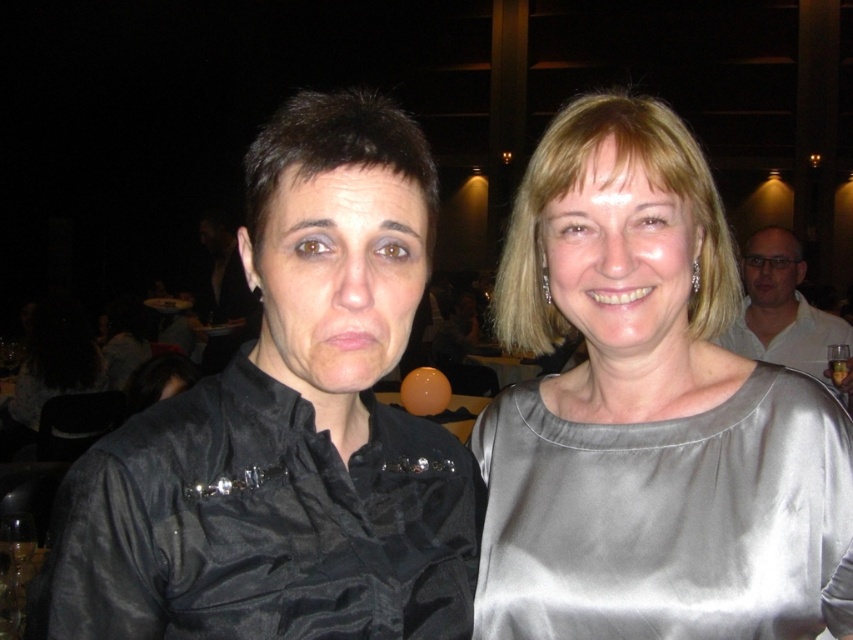
Question: Which of the following is the closest to the observer?

Choices:
 (A) white glossy shirt at upper right
 (B) satin gray face at center

Answer: (B)

Question: Can you confirm if satin gray blouse at upper right is positioned to the right of satin gray dress at upper right?

Choices:
 (A) no
 (B) yes

Answer: (B)

Question: Which of the following is the closest to the observer?

Choices:
 (A) satin gray blouse at upper right
 (B) satin gray face at center
 (C) white glossy shirt at upper right
 (D) matte black face at center

Answer: (D)

Question: Is satin gray blouse at upper right to the left of matte white face at upper right from the viewer's perspective?

Choices:
 (A) no
 (B) yes

Answer: (B)

Question: Estimate the real-world distances between objects in this image. Which object is closer to the satin gray blouse at upper right?

Choices:
 (A) matte white face at upper right
 (B) matte black face at center
 (C) satin gray dress at upper right
 (D) satin gray face at center

Answer: (C)

Question: Is satin gray blouse at upper right positioned at the back of satin gray face at center?

Choices:
 (A) no
 (B) yes

Answer: (A)